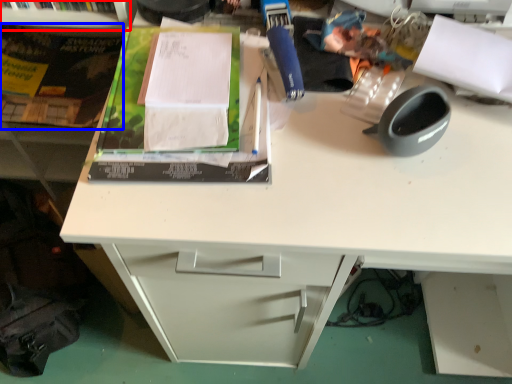
Question: Which object is further to the camera taking this photo, shelf (highlighted by a red box) or paperback book (highlighted by a blue box)?

Choices:
 (A) shelf
 (B) paperback book

Answer: (B)